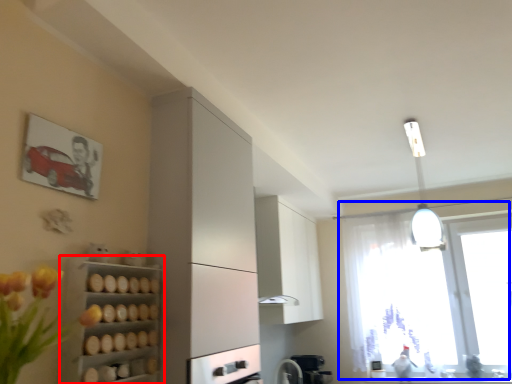
Question: Which point is closer to the camera, shelf (highlighted by a red box) or window (highlighted by a blue box)?

Choices:
 (A) shelf
 (B) window

Answer: (A)